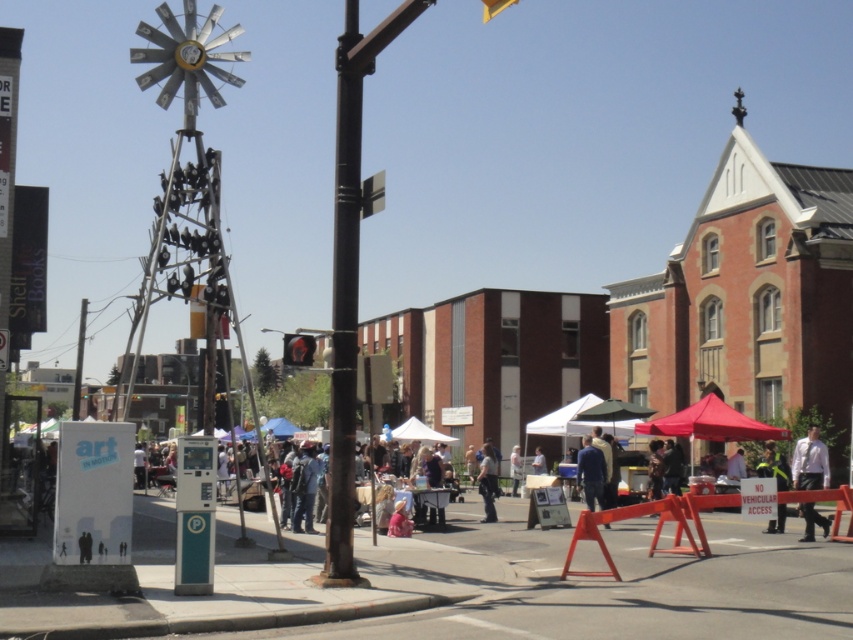
Question: Which object appears farthest from the camera in this image?

Choices:
 (A) light blue jeans at center
 (B) metallic rectangular street sign at upper center
 (C) red fabric canopy at right
 (D) black metal pole at center

Answer: (C)

Question: Does red glass traffic light at center appear on the right side of yellow matte traffic light at upper center?

Choices:
 (A) yes
 (B) no

Answer: (B)

Question: Based on their relative distances, which object is farther from the white plastic sign at upper left?

Choices:
 (A) light blue jeans at center
 (B) blue fabric canopy at center

Answer: (B)

Question: Is white plastic sign at lower right below light blue jeans at center?

Choices:
 (A) yes
 (B) no

Answer: (B)

Question: Can you confirm if blue fabric jacket at center is positioned above metallic rectangular street sign at upper center?

Choices:
 (A) yes
 (B) no

Answer: (B)

Question: Which point is closer to the camera?

Choices:
 (A) (306, 344)
 (B) (601, 493)
 (C) (706, 436)
 (D) (781, 486)

Answer: (A)